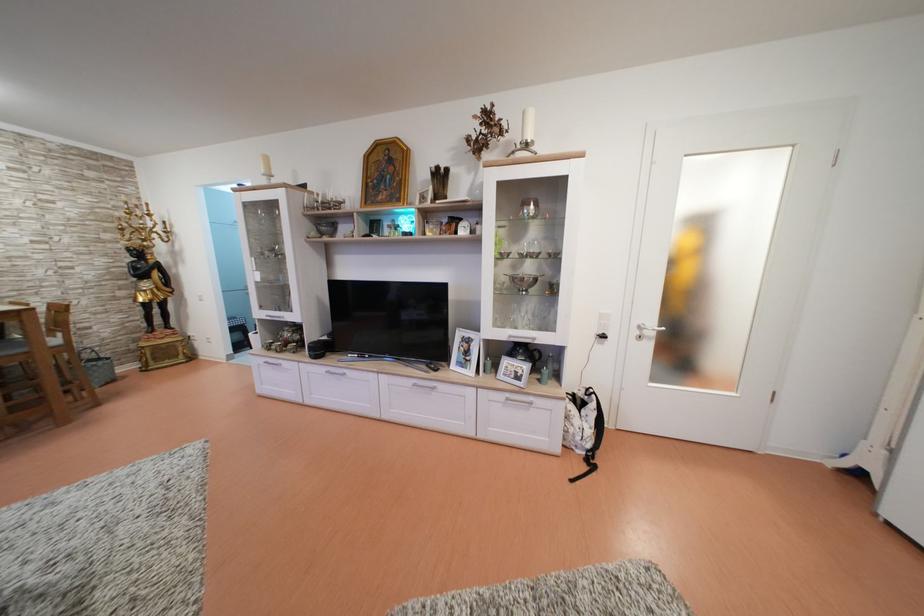
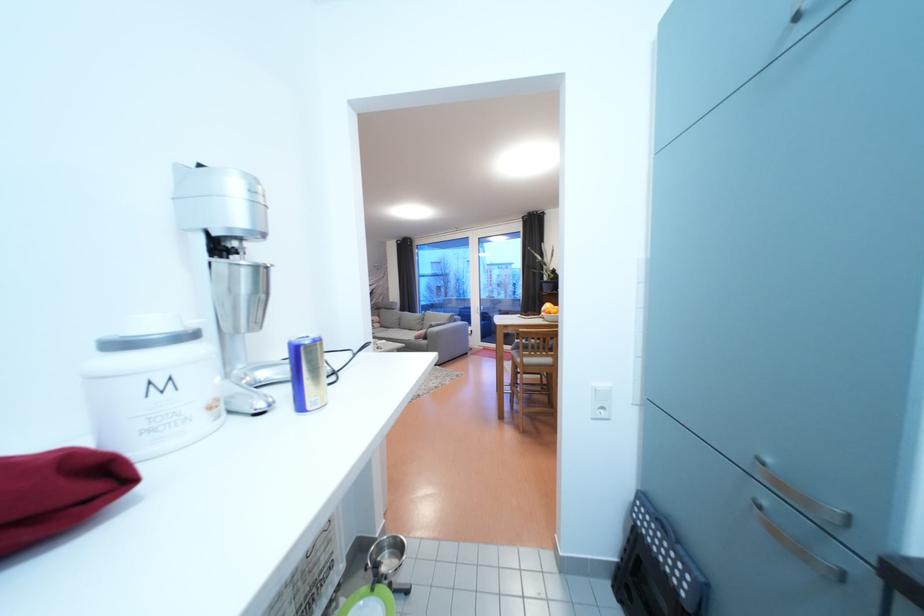
Question: I am providing you with two images of the same scene from different viewpoints. Which of the following objects are not visible in image2?

Choices:
 (A) black remote control
 (B) metal cabinet handle
 (C) metal scoop
 (D) colorful folded bag

Answer: (A)